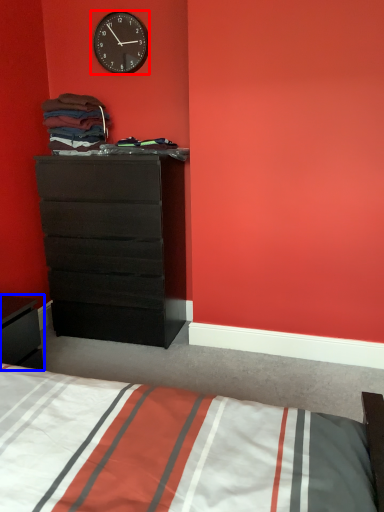
Question: Which object appears closest to the camera in this image, wall clock (highlighted by a red box) or nightstand (highlighted by a blue box)?

Choices:
 (A) wall clock
 (B) nightstand

Answer: (B)